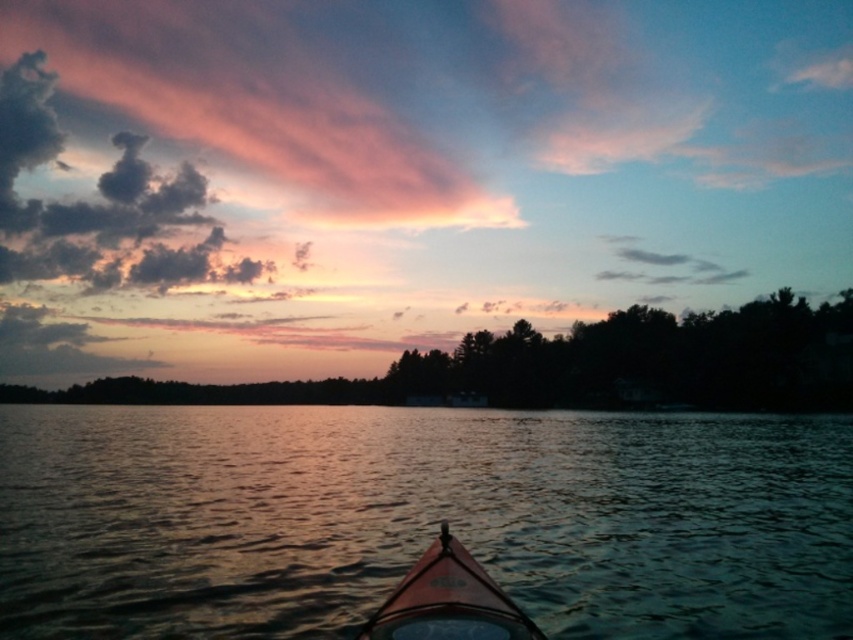
Can you confirm if shiny dark water at center is taller than orange matte kayak at center?

Yes.

Is point (704, 449) closer to viewer compared to point (488, 604)?

No.

At what (x,y) coordinates should I click in order to perform the action: click on shiny dark water at center. Please return your answer as a coordinate pair (x, y). Looking at the image, I should click on (421, 518).